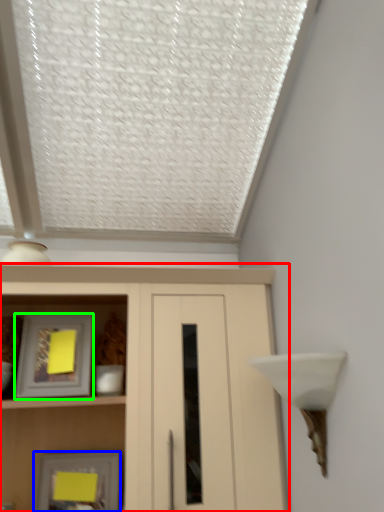
Question: Which is farther away from cupboard (highlighted by a red box)? picture frame (highlighted by a blue box) or picture frame (highlighted by a green box)?

Choices:
 (A) picture frame
 (B) picture frame

Answer: (A)